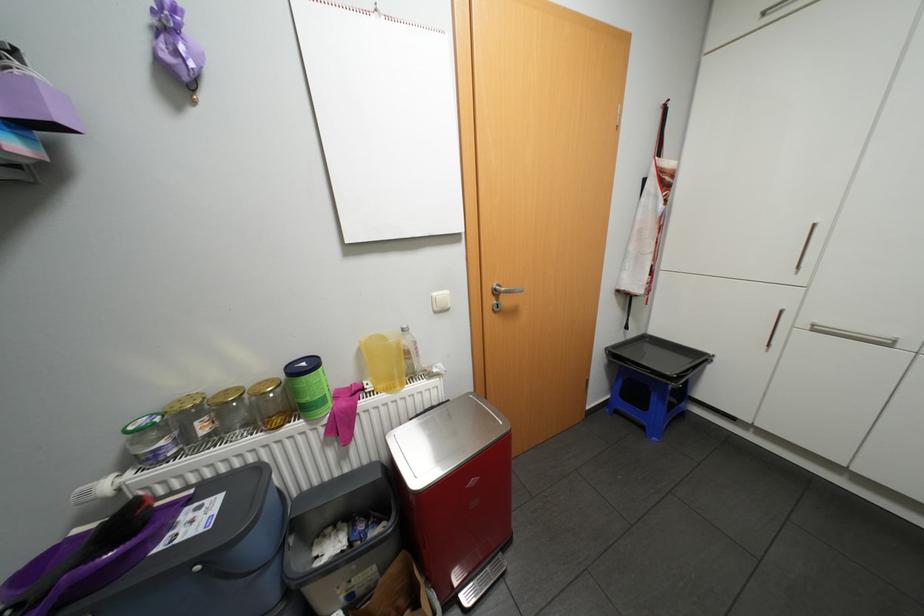
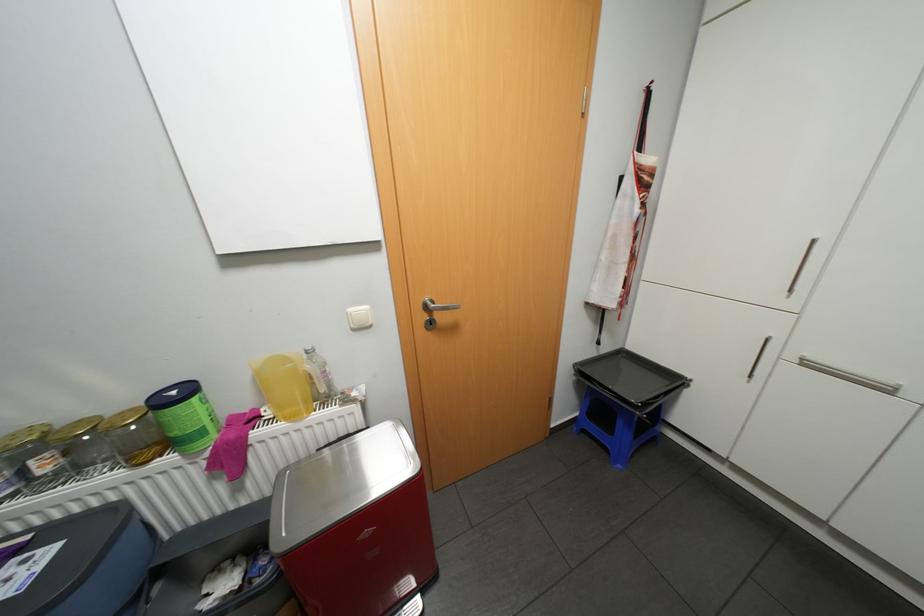
Locate, in the second image, the point that corresponds to point 443,293 in the first image.

(358, 309)